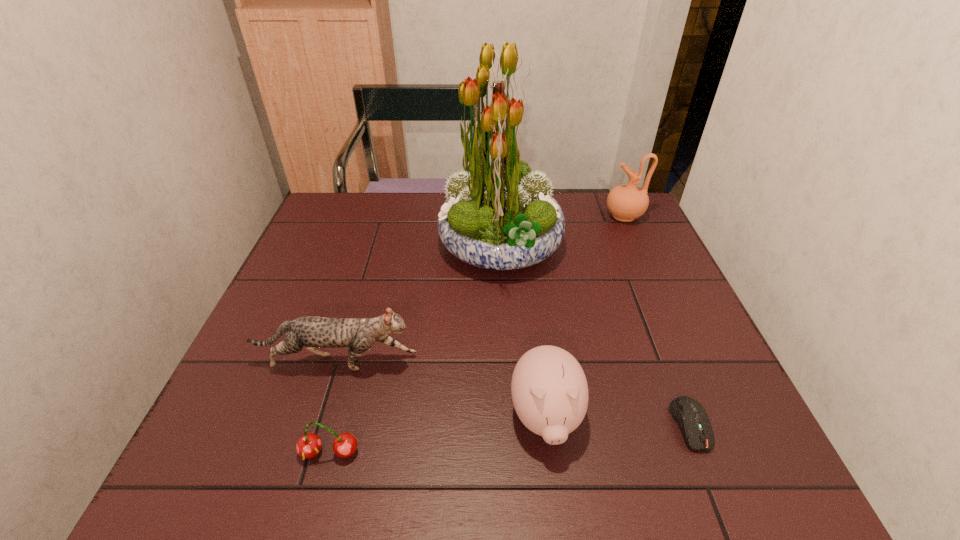
This screenshot has height=540, width=960. What are the coordinates of `free space at the far right corner of the desktop` in the screenshot? It's located at (646, 217).

This screenshot has height=540, width=960. In order to click on unoccupied position between the cherry and the piggy bank in this screenshot , I will do `click(438, 435)`.

The height and width of the screenshot is (540, 960). In order to click on unoccupied position between the piggy bank and the pottery in this screenshot , I will do `click(585, 316)`.

This screenshot has width=960, height=540. What are the coordinates of `vacant space in between the computer equipment and the cherry` in the screenshot? It's located at (510, 438).

Locate an element on the screen. free space between the computer equipment and the pottery is located at coordinates (658, 320).

This screenshot has width=960, height=540. Find the location of `free space between the fifth shortest object and the fifth tallest object`. free space between the fifth shortest object and the fifth tallest object is located at coordinates (477, 334).

You are a GUI agent. You are given a task and a screenshot of the screen. Output one action in this format:
    pyautogui.click(x=<x>, y=<y>)
    Task: Click on the unoccupied area between the flower arrangement and the cat
    The width and height of the screenshot is (960, 540).
    Given the screenshot: What is the action you would take?
    pyautogui.click(x=419, y=304)

You are a GUI agent. You are given a task and a screenshot of the screen. Output one action in this format:
    pyautogui.click(x=<x>, y=<y>)
    Task: Click on the blank region between the fifth shortest object and the piggy bank
    
    Given the screenshot: What is the action you would take?
    pyautogui.click(x=585, y=316)

The width and height of the screenshot is (960, 540). What are the coordinates of `empty space between the cherry and the piggy bank` in the screenshot? It's located at tap(438, 435).

Identify the location of empty location between the pottery and the piggy bank. coord(585,316).